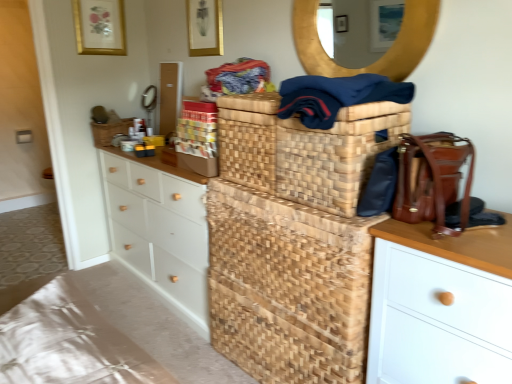
Question: Considering their positions, is navy blue fabric at upper center located in front of or behind beige textured fabric at lower left?

Choices:
 (A) front
 (B) behind

Answer: (A)

Question: Choose the correct answer: Is navy blue fabric at upper center inside beige textured fabric at lower left or outside it?

Choices:
 (A) inside
 (B) outside

Answer: (B)

Question: Which is nearer to the white matte chest of drawers at left?

Choices:
 (A) matte gold picture frame at upper center, positioned as the second picture frame in right-to-left order
 (B) matte gold picture frame at upper center, which is counted as the 1th picture frame, starting from the front
 (C) natural woven basket at center, arranged as the 1th basket when viewed from the front
 (D) woven brown basket at center, which appears as the first basket when viewed from the left
 (E) natural woven basket at center

Answer: (E)

Question: Which is farther from the woven brown basket at center, the 2th basket positioned from the front?

Choices:
 (A) natural woven basket at center, positioned as the first basket in right-to-left order
 (B) matte gold picture frame at upper center, positioned as the 2th picture frame in front-to-back order
 (C) beige textured fabric at lower left
 (D) navy blue fabric at upper center
 (E) white matte chest of drawers at left

Answer: (D)